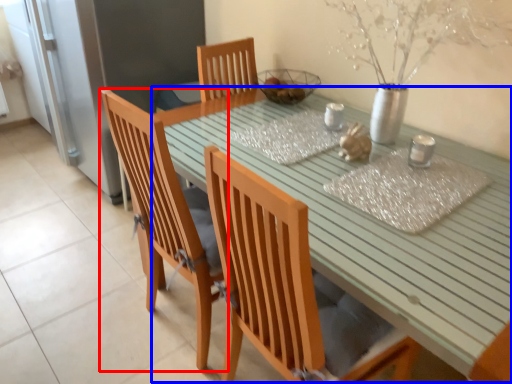
Question: Which object appears closest to the camera in this image, chair (highlighted by a red box) or table (highlighted by a blue box)?

Choices:
 (A) chair
 (B) table

Answer: (B)